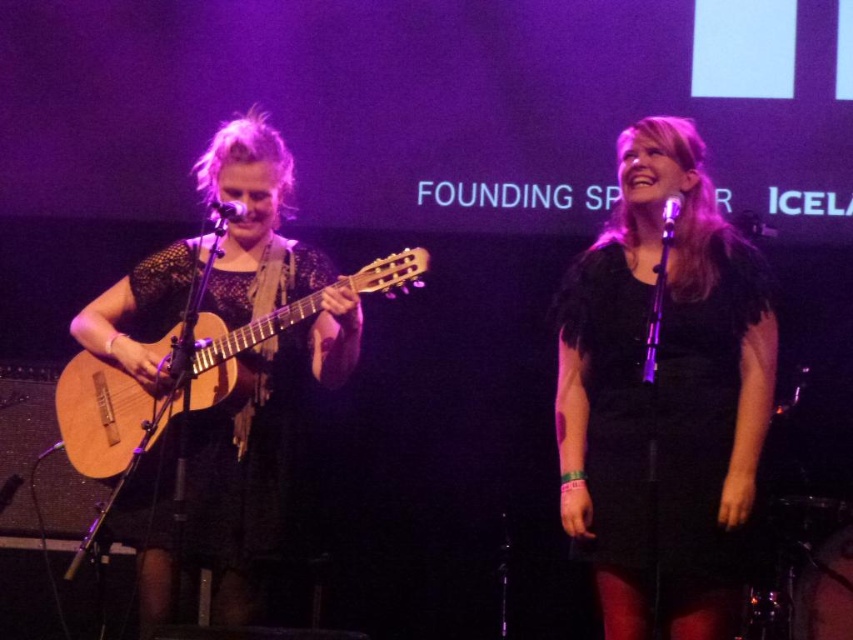
Question: Is black feathered dress at center positioned in front of natural wood acoustic guitar at left?

Choices:
 (A) yes
 (B) no

Answer: (A)

Question: Among these objects, which one is nearest to the camera?

Choices:
 (A) black feathered dress at center
 (B) natural wood acoustic guitar at left

Answer: (A)

Question: Can you confirm if black feathered dress at center is smaller than natural wood acoustic guitar at left?

Choices:
 (A) yes
 (B) no

Answer: (B)

Question: From the image, what is the correct spatial relationship of black feathered dress at center in relation to natural wood acoustic guitar at left?

Choices:
 (A) right
 (B) left

Answer: (A)

Question: Which point is farther from the camera taking this photo?

Choices:
 (A) (192, 369)
 (B) (757, 342)

Answer: (A)